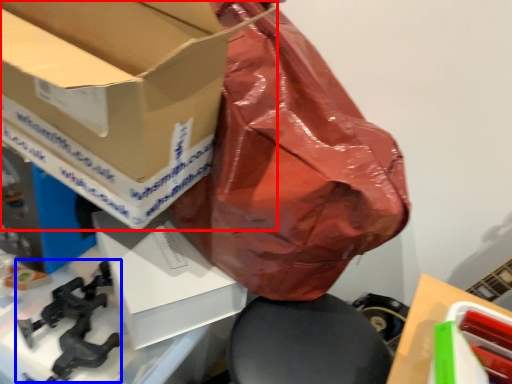
Question: Among these objects, which one is nearest to the camera, box (highlighted by a red box) or weapon (highlighted by a blue box)?

Choices:
 (A) box
 (B) weapon

Answer: (A)